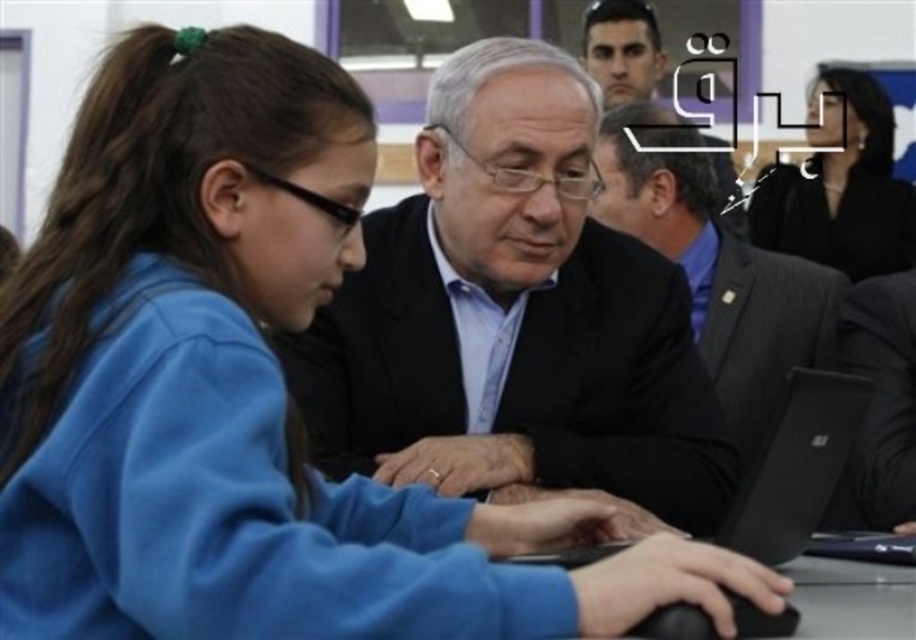
Question: Is dark gray suit at center closer to camera compared to black textured suit at center?

Choices:
 (A) yes
 (B) no

Answer: (B)

Question: Which of the following is the closest to the observer?

Choices:
 (A) dark gray suit at center
 (B) black textured suit at center

Answer: (B)

Question: Among these objects, which one is farthest from the camera?

Choices:
 (A) black glossy hair at upper right
 (B) black textured suit at center
 (C) matte black suit at center

Answer: (A)

Question: Does matte black suit at center lie behind black glossy hair at upper right?

Choices:
 (A) yes
 (B) no

Answer: (B)

Question: Which object appears farthest from the camera in this image?

Choices:
 (A) black glossy hair at upper right
 (B) black matte laptop at center
 (C) dark suit at center
 (D) black textured suit at center

Answer: (C)

Question: Is dark gray suit at center thinner than black textured suit at center?

Choices:
 (A) yes
 (B) no

Answer: (B)